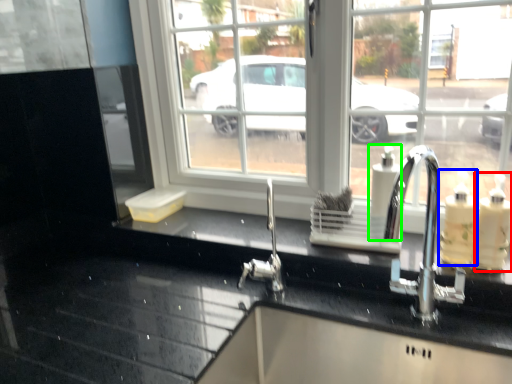
Question: Based on their relative distances, which object is nearer to soap dispenser (highlighted by a red box)? Choose from soap dispenser (highlighted by a blue box) and soap dispenser (highlighted by a green box).

Choices:
 (A) soap dispenser
 (B) soap dispenser

Answer: (A)